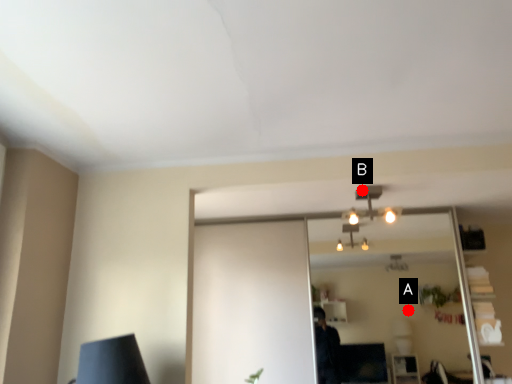
Question: Two points are circled on the image, labeled by A and B beside each circle. Which point is further to the camera?

Choices:
 (A) A is further
 (B) B is further

Answer: (A)